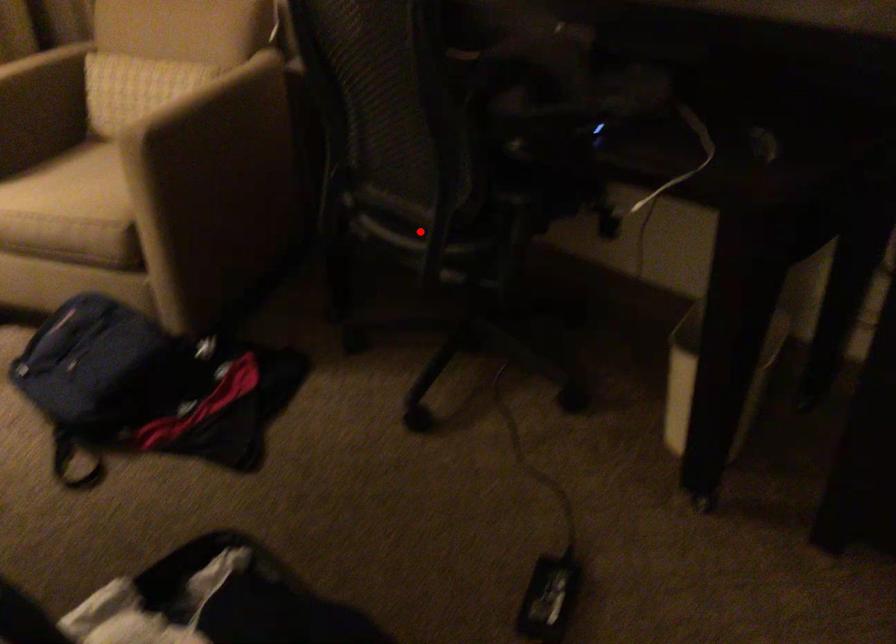
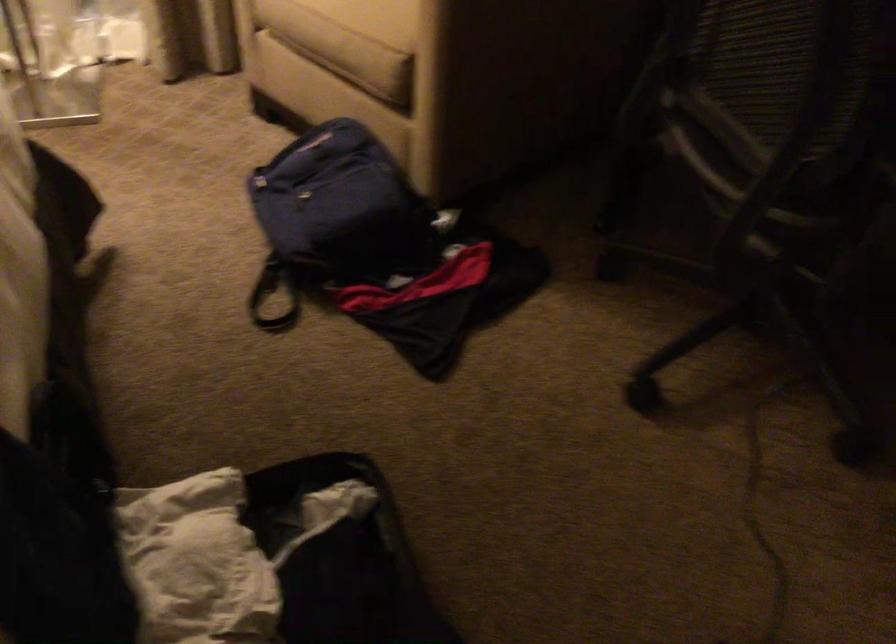
Question: A red point is marked in image1. In image2, is the corresponding 3D point closer to the camera or farther? Reply with the corresponding letter.

Choices:
 (A) The corresponding 3D point is closer.
 (B) The corresponding 3D point is farther.

Answer: (A)